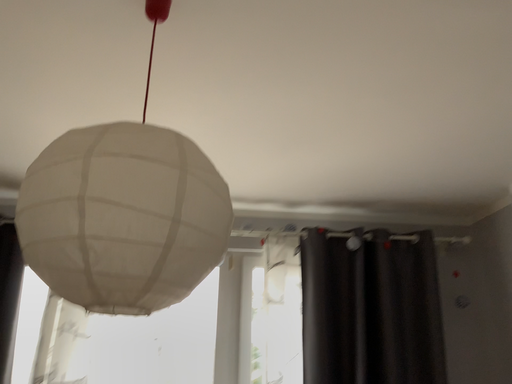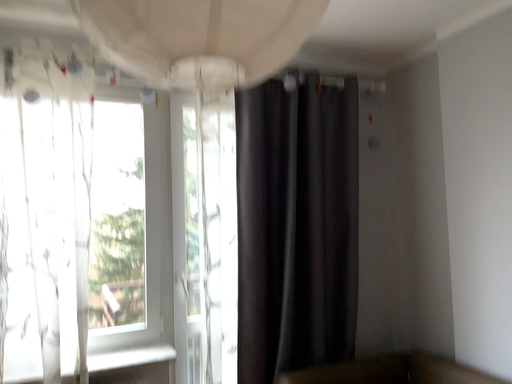
Question: How did the camera likely rotate when shooting the video?

Choices:
 (A) rotated right
 (B) rotated left

Answer: (A)